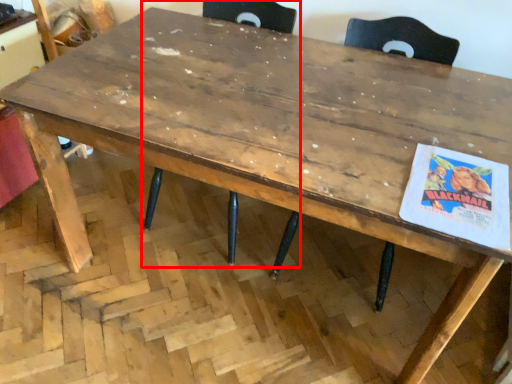
Question: Considering the relative positions of chair (annotated by the red box) and chair in the image provided, where is chair (annotated by the red box) located with respect to the staircase?

Choices:
 (A) right
 (B) left

Answer: (B)